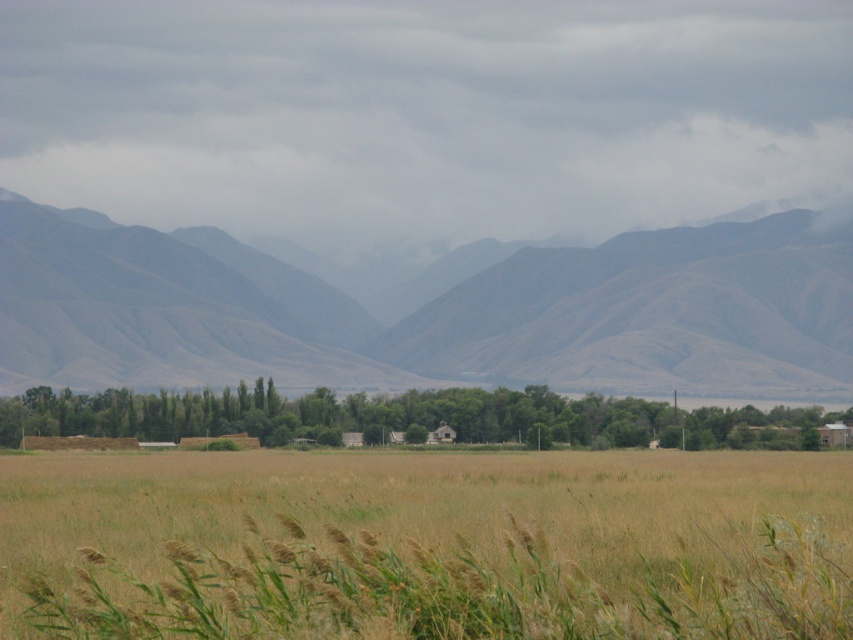
Question: Which point is farther to the camera?

Choices:
 (A) (264, 436)
 (B) (84, 525)

Answer: (A)

Question: Does gray textured mountains at center appear under green leafy trees at center?

Choices:
 (A) no
 (B) yes

Answer: (A)

Question: Does gray textured mountains at center appear on the left side of green leafy trees at center?

Choices:
 (A) no
 (B) yes

Answer: (B)

Question: From the image, what is the correct spatial relationship of brown grassland at center in relation to gray textured mountains at center?

Choices:
 (A) left
 (B) right

Answer: (B)

Question: Which of the following is the farthest from the observer?

Choices:
 (A) (74, 348)
 (B) (683, 416)
 (C) (183, 620)

Answer: (A)

Question: Which point is farther to the camera?

Choices:
 (A) brown grassland at center
 (B) green leafy trees at center

Answer: (B)